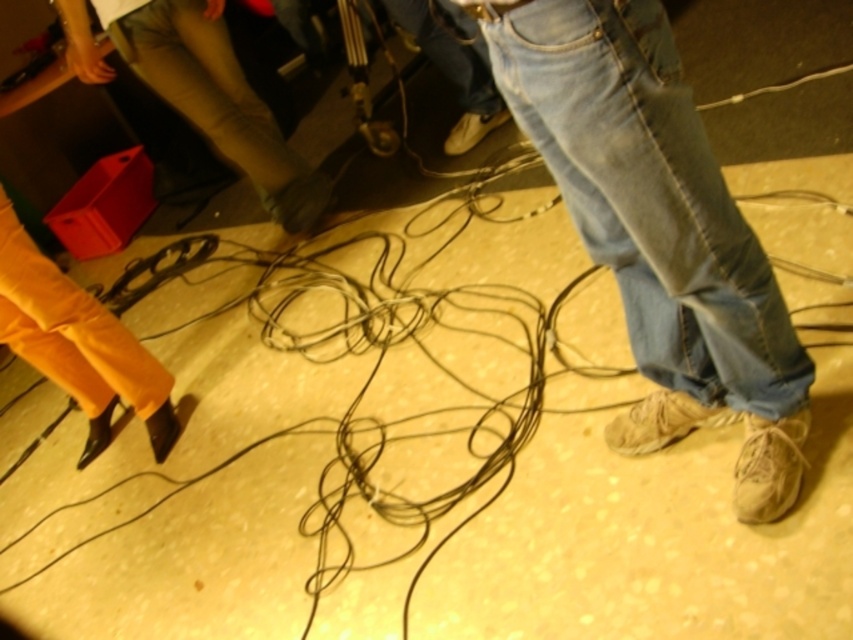
The height and width of the screenshot is (640, 853). Identify the location of denim jeans at center. (659, 230).

Does point (514, 88) lie in front of point (161, 10)?

Yes.

Locate an element on the screen. The image size is (853, 640). denim jeans at center is located at coordinates (659, 230).